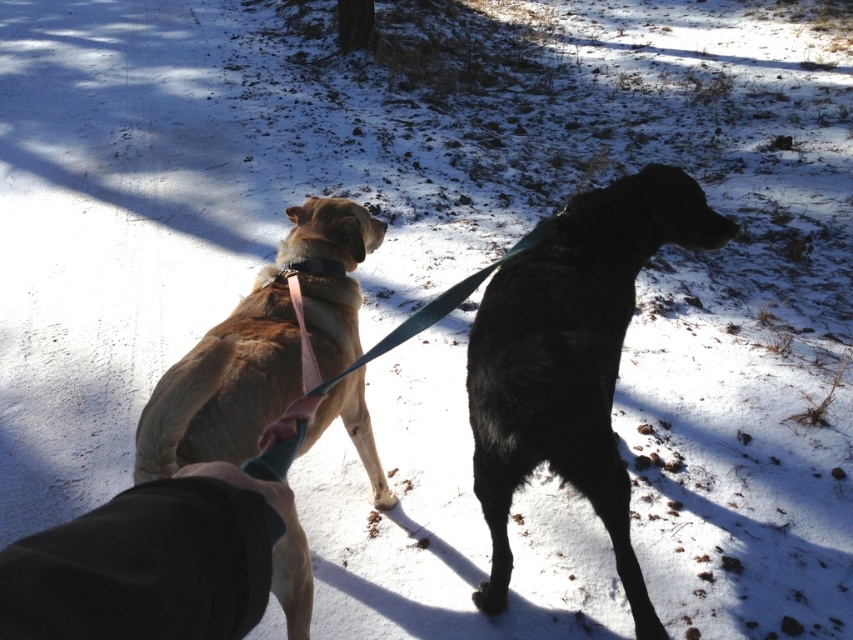
Does black fabric pants at lower left appear on the right side of pink fabric neckband at upper center?

Yes, black fabric pants at lower left is to the right of pink fabric neckband at upper center.

Does black fabric pants at lower left have a smaller size compared to pink fabric neckband at upper center?

Incorrect, black fabric pants at lower left is not smaller in size than pink fabric neckband at upper center.

You are a GUI agent. You are given a task and a screenshot of the screen. Output one action in this format:
    pyautogui.click(x=<x>, y=<y>)
    Task: Click on the black fabric pants at lower left
    This screenshot has width=853, height=640.
    Given the screenshot: What is the action you would take?
    pyautogui.click(x=149, y=563)

Can you confirm if black fur dog at right is positioned to the left of pink fabric neckband at upper center?

Incorrect, black fur dog at right is not on the left side of pink fabric neckband at upper center.

The width and height of the screenshot is (853, 640). What do you see at coordinates (572, 358) in the screenshot?
I see `black fur dog at right` at bounding box center [572, 358].

You are a GUI agent. You are given a task and a screenshot of the screen. Output one action in this format:
    pyautogui.click(x=<x>, y=<y>)
    Task: Click on the black fur dog at right
    This screenshot has height=640, width=853.
    Given the screenshot: What is the action you would take?
    pyautogui.click(x=572, y=358)

The image size is (853, 640). What do you see at coordinates (572, 358) in the screenshot? I see `black fur dog at right` at bounding box center [572, 358].

Where is `black fur dog at right`? The image size is (853, 640). black fur dog at right is located at coordinates (572, 358).

I want to click on black fur dog at right, so click(572, 358).